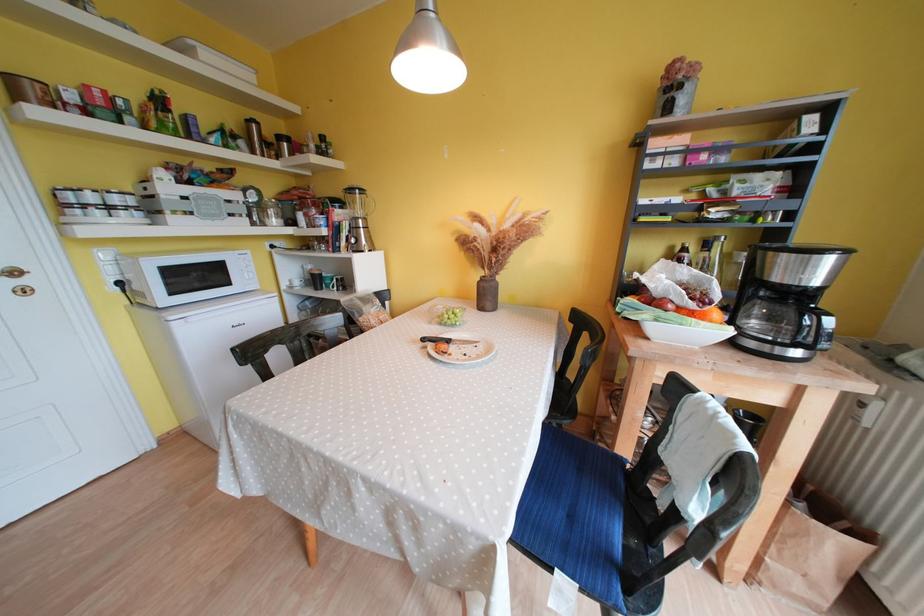
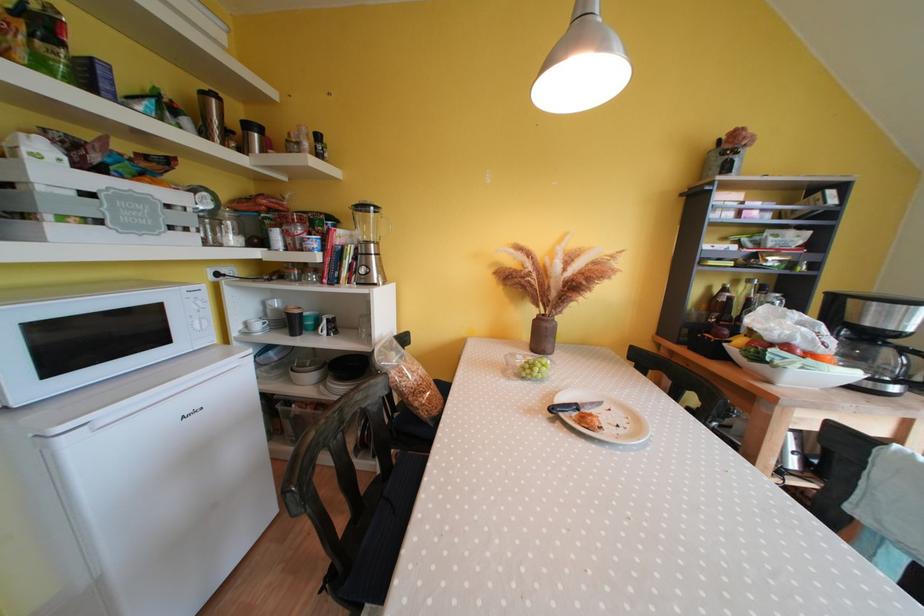
The point at (470, 359) is marked in the first image. Where is the corresponding point in the second image?

(624, 430)